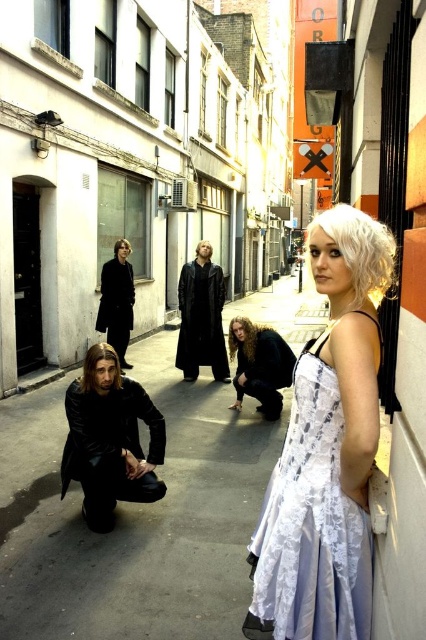
Is black matte robe at center positioned at the back of dark brown straight hair at center?

No, it is in front of dark brown straight hair at center.

Between point (106, 301) and point (120, 243), which one is positioned behind?

Point (120, 243)

Find the location of a particular element. black matte robe at center is located at coordinates (117, 301).

Which is behind, point (32, 552) or point (230, 344)?

Point (230, 344)

Between black leather jacket at lower left and curly blonde hair at center, which one is positioned higher?

curly blonde hair at center is higher up.

What do you see at coordinates (135, 516) in the screenshot? I see `black leather jacket at lower left` at bounding box center [135, 516].

This screenshot has height=640, width=426. I want to click on black leather jacket at lower left, so click(x=135, y=516).

Is white curly wig at right positioned before dark brown straight hair at center?

Yes.

Is point (322, 220) in front of point (114, 248)?

That is True.

What do you see at coordinates (359, 250) in the screenshot? I see `white curly wig at right` at bounding box center [359, 250].

Where is `white curly wig at right`? white curly wig at right is located at coordinates (359, 250).